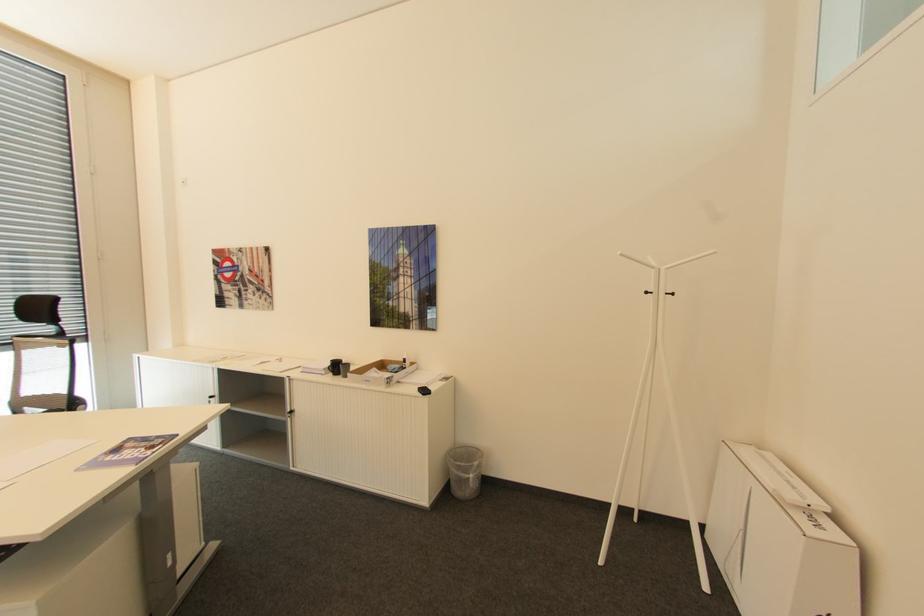
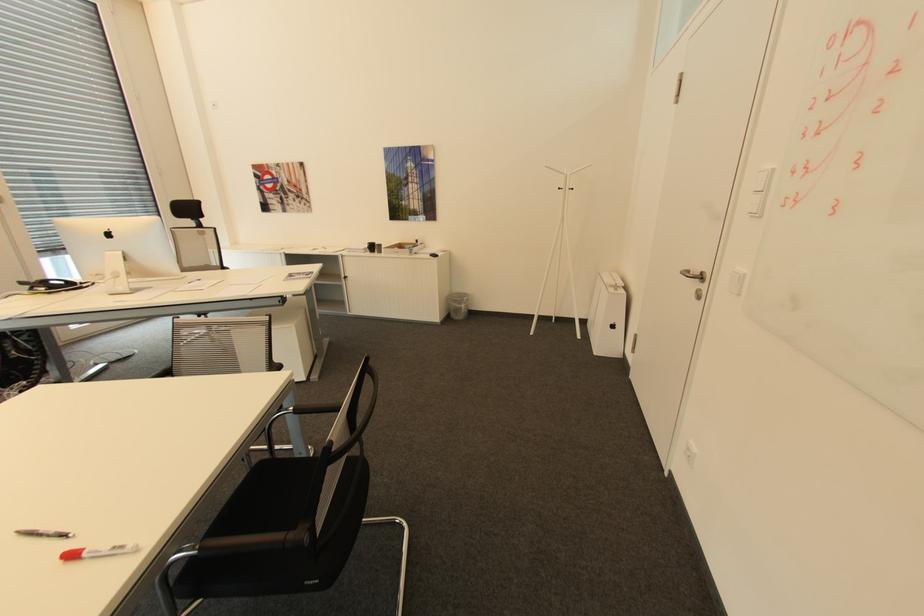
Question: The images are taken continuously from a first-person perspective. In which direction are you moving?

Choices:
 (A) Left
 (B) Right
 (C) Forward
 (D) Backward

Answer: (D)